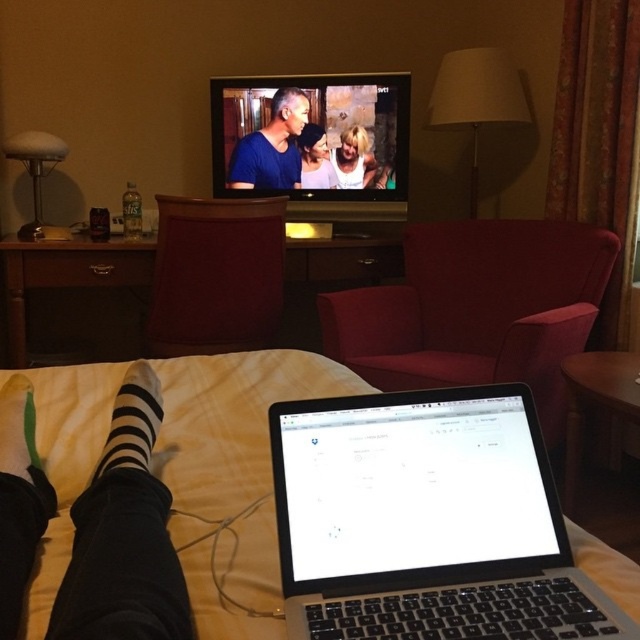
You are a photographer taking a picture of the two points in the scene. Which point is closer to the camera, point (272, 186) or point (344, 134)?

Point (272, 186) is closer to the camera than point (344, 134).

You are a fashion designer observing the blue matte shirt at center and the white matte tank top at center in the image. Which clothing item has a greater width?

The blue matte shirt at center has a greater width than the white matte tank top at center according to the description.

You are standing in the hotel room and want to sit down. There is a point marked at coordinates (477,308). What object is located at that point?

The point at coordinates (477,308) indicates the location of the matte red armchair at center.